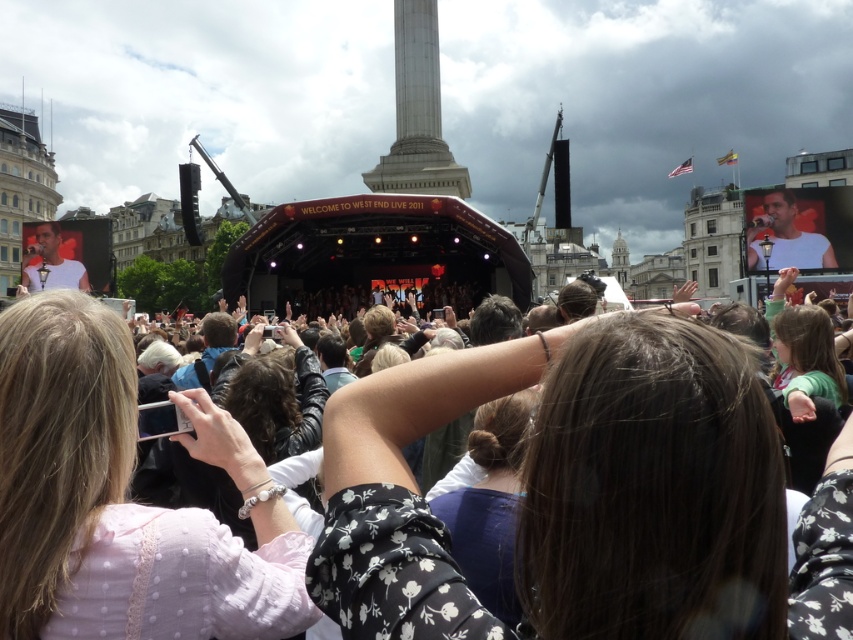
Question: Can you confirm if black floral shirt at center is positioned to the right of pink fabric at center?

Choices:
 (A) yes
 (B) no

Answer: (A)

Question: Which point is farther to the camera?

Choices:
 (A) (347, 406)
 (B) (241, 552)

Answer: (A)

Question: Is black floral shirt at center to the right of pink fabric at center from the viewer's perspective?

Choices:
 (A) no
 (B) yes

Answer: (B)

Question: Which point is closer to the camera taking this photo?

Choices:
 (A) (36, 440)
 (B) (750, 429)

Answer: (B)

Question: Considering the relative positions of black floral shirt at center and pink fabric at center in the image provided, where is black floral shirt at center located with respect to pink fabric at center?

Choices:
 (A) below
 (B) above

Answer: (B)